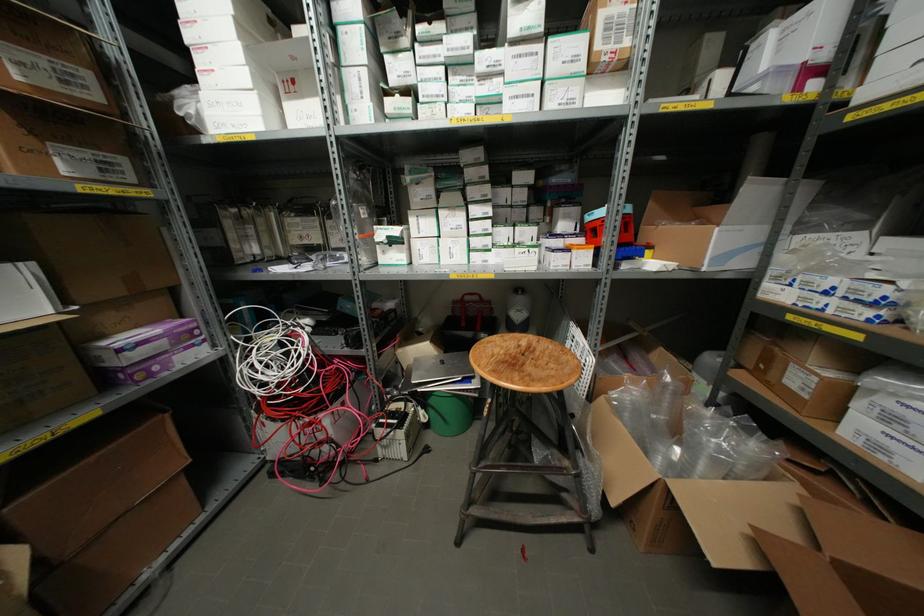
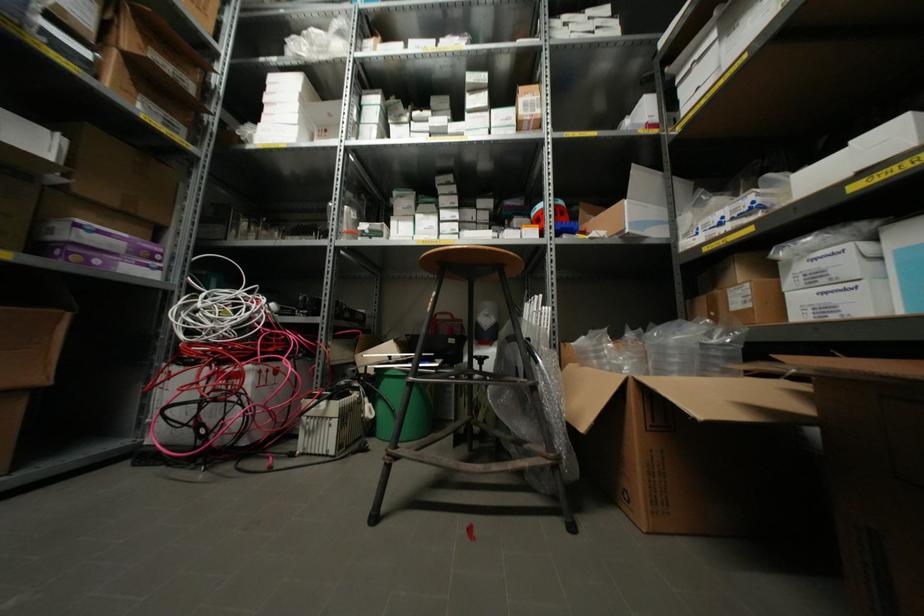
Where in the second image is the point corresponding to (399,434) from the first image?

(334, 406)